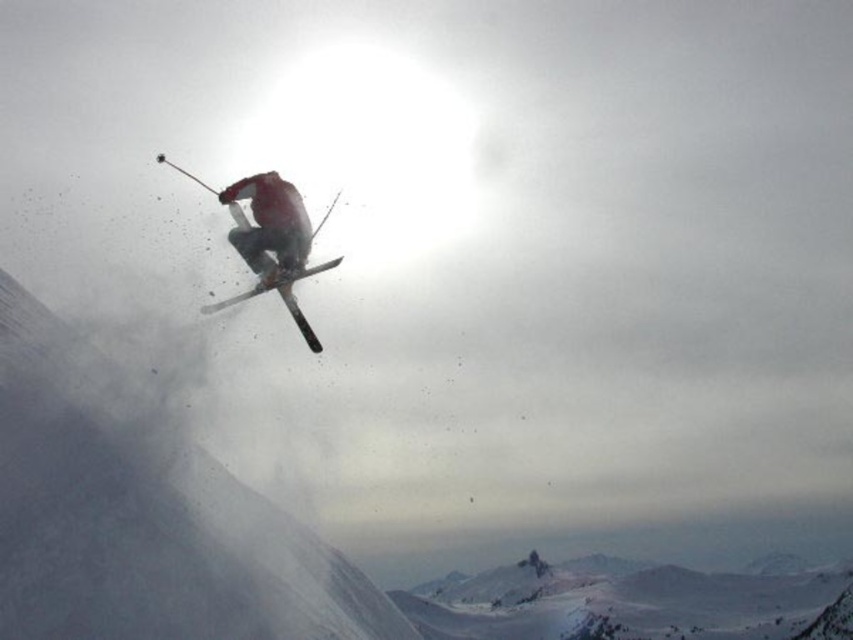
Question: Which point is farther from the camera taking this photo?

Choices:
 (A) (236, 214)
 (B) (305, 208)

Answer: (A)

Question: Can you confirm if matte red ski suit at center is positioned to the right of shiny red snowboard at center?

Choices:
 (A) yes
 (B) no

Answer: (A)

Question: Does shiny red snowboard at center come in front of shiny metallic ski at center?

Choices:
 (A) yes
 (B) no

Answer: (B)

Question: Does shiny red snowboard at center have a greater width compared to shiny metallic ski at center?

Choices:
 (A) no
 (B) yes

Answer: (B)

Question: Which object is the closest to the matte red ski suit at center?

Choices:
 (A) shiny red snowboard at center
 (B) shiny metallic ski at center

Answer: (A)

Question: Which object is positioned farthest from the shiny red snowboard at center?

Choices:
 (A) shiny metallic ski at center
 (B) matte red ski suit at center

Answer: (B)